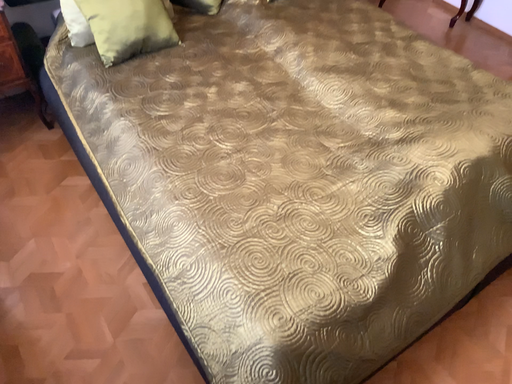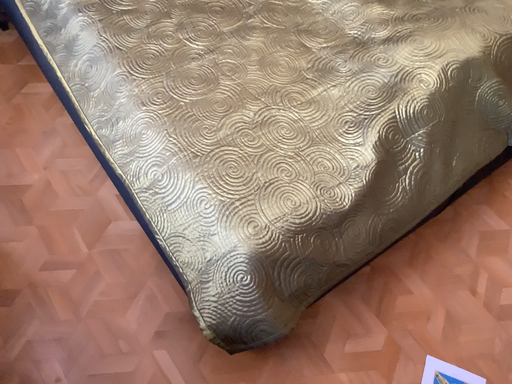
Question: Which way did the camera rotate in the video?

Choices:
 (A) rotated upward
 (B) rotated downward

Answer: (B)